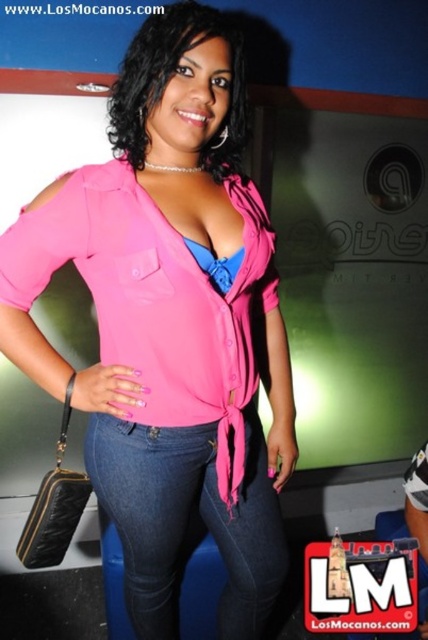
Based on the scene description, where is the pink matte shirt at center located in terms of its 2D coordinates?

The pink matte shirt at center is located at the 2D coordinates of point (171, 323).

You are a fashion designer analyzing the outfit of a person in an image. The person is wearing a pink matte shirt at center and denim jeans at center. Based on the visual information provided, which item of clothing is wider?

The pink matte shirt at center is wider than the denim jeans at center.

In the scene shown: You are a fashion designer analyzing the outfit of the person in the image. The pink matte shirt at center and denim jeans at center are part of their look. Based on their positioning, which clothing item is located more to the left?

The pink matte shirt at center is positioned on the left side of denim jeans at center, so the pink matte shirt at center is more to the left.